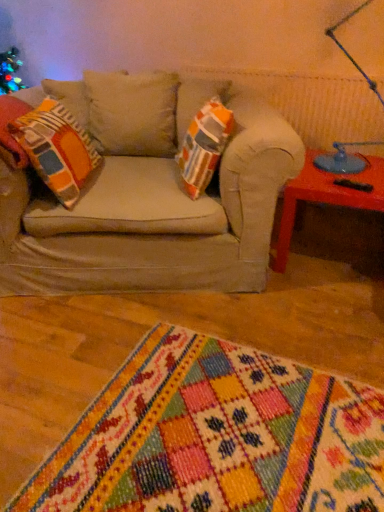
Question: Can you confirm if multicolored woven rug at lower center is thinner than blue glass table lamp at upper right?

Choices:
 (A) yes
 (B) no

Answer: (B)

Question: Considering the relative positions of multicolored woven rug at lower center and blue glass table lamp at upper right in the image provided, is multicolored woven rug at lower center to the right of blue glass table lamp at upper right from the viewer's perspective?

Choices:
 (A) no
 (B) yes

Answer: (A)

Question: From the image's perspective, is multicolored woven rug at lower center on top of blue glass table lamp at upper right?

Choices:
 (A) no
 (B) yes

Answer: (A)

Question: Is multicolored woven rug at lower center positioned before blue glass table lamp at upper right?

Choices:
 (A) yes
 (B) no

Answer: (A)

Question: Is multicolored woven rug at lower center shorter than blue glass table lamp at upper right?

Choices:
 (A) no
 (B) yes

Answer: (B)

Question: Is multicolored woven rug at lower center positioned beyond the bounds of blue glass table lamp at upper right?

Choices:
 (A) no
 (B) yes

Answer: (B)

Question: From a real-world perspective, is multicolored woven rug at lower center on orange and gray striped pillow at left?

Choices:
 (A) yes
 (B) no

Answer: (B)

Question: Could you tell me if multicolored woven rug at lower center is turned towards orange and gray striped pillow at left?

Choices:
 (A) no
 (B) yes

Answer: (A)

Question: From the image's perspective, would you say multicolored woven rug at lower center is shown under orange and gray striped pillow at left?

Choices:
 (A) yes
 (B) no

Answer: (A)

Question: Is orange and gray striped pillow at left surrounded by multicolored woven rug at lower center?

Choices:
 (A) yes
 (B) no

Answer: (B)

Question: Is multicolored woven rug at lower center thinner than orange and gray striped pillow at left?

Choices:
 (A) yes
 (B) no

Answer: (B)

Question: Is multicolored woven rug at lower center to the left of orange and gray striped pillow at left from the viewer's perspective?

Choices:
 (A) no
 (B) yes

Answer: (A)

Question: Is blue glass table lamp at upper right aimed at multicolored woven rug at lower center?

Choices:
 (A) no
 (B) yes

Answer: (A)